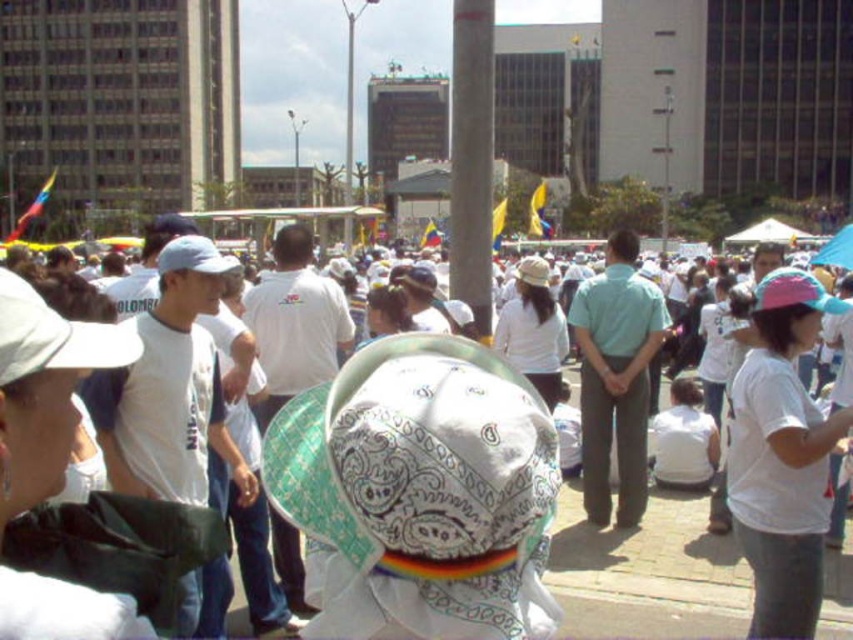
Is white cotton shirt at center closer to the viewer compared to smooth concrete pole at center?

Yes, it is in front of smooth concrete pole at center.

Based on the photo, does white cotton shirt at center lie behind smooth concrete pole at center?

No, it is in front of smooth concrete pole at center.

Is point (701, 520) positioned after point (480, 148)?

No, it is not.

Where is `white cotton shirt at center`? The width and height of the screenshot is (853, 640). white cotton shirt at center is located at coordinates (648, 570).

Can you confirm if pink fabric cap at center is smaller than white cotton shirt at center?

Incorrect, pink fabric cap at center is not smaller in size than white cotton shirt at center.

Can you confirm if pink fabric cap at center is wider than white cotton shirt at center?

Yes.

Is point (798, 326) positioned behind point (561, 580)?

No, it is in front of (561, 580).

Where is `pink fabric cap at center`? This screenshot has width=853, height=640. pink fabric cap at center is located at coordinates (782, 456).

Can you confirm if white printed fabric baseball hat at center is positioned below white cotton shirt at center?

No, white printed fabric baseball hat at center is not below white cotton shirt at center.

Does white printed fabric baseball hat at center appear over white cotton shirt at center?

Yes.

What do you see at coordinates (421, 492) in the screenshot?
I see `white printed fabric baseball hat at center` at bounding box center [421, 492].

Image resolution: width=853 pixels, height=640 pixels. Identify the location of white printed fabric baseball hat at center. (421, 492).